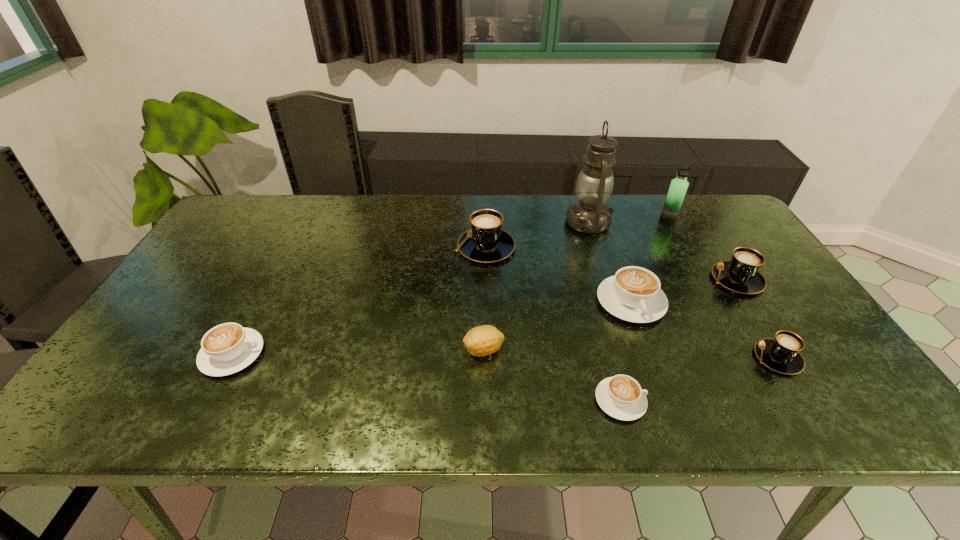
Select which cappuccino is the sixth closest to the lemon. Please provide its 2D coordinates. Your answer should be formatted as a tuple, i.e. [(x, y)], where the tuple contains the x and y coordinates of a point satisfying the conditions above.

[(740, 274)]

The image size is (960, 540). I want to click on cappuccino identified as the second closest to the oil lamp, so click(633, 294).

Identify which black cappuccino is the third nearest to the smallest white cappuccino. Please provide its 2D coordinates. Your answer should be formatted as a tuple, i.e. [(x, y)], where the tuple contains the x and y coordinates of a point satisfying the conditions above.

[(486, 242)]

The width and height of the screenshot is (960, 540). In order to click on black cappuccino that is the third nearest to the shortest cappuccino in this screenshot , I will do point(486,242).

Identify the location of white cappuccino object that ranks as the third closest to the lemon. (227, 348).

Select which white cappuccino is the second closest to the nearest black cappuccino. Please provide its 2D coordinates. Your answer should be formatted as a tuple, i.e. [(x, y)], where the tuple contains the x and y coordinates of a point satisfying the conditions above.

[(621, 397)]

Locate an element on the screen. The width and height of the screenshot is (960, 540). free space that satisfies the following two spatial constraints: 1. on the side of the leftmost object with the handle; 2. on the right side of the nearest black cappuccino is located at coordinates [x=230, y=358].

You are a GUI agent. You are given a task and a screenshot of the screen. Output one action in this format:
    pyautogui.click(x=<x>, y=<y>)
    Task: Click on the free space that satisfies the following two spatial constraints: 1. on the back side of the leftmost black cappuccino; 2. on the right side of the tallest object
    The height and width of the screenshot is (540, 960).
    Given the screenshot: What is the action you would take?
    point(485,222)

I want to click on vacant position in the image that satisfies the following two spatial constraints: 1. on the front side of the tallest object; 2. on the side of the leftmost cappuccino with the handle, so click(630, 354).